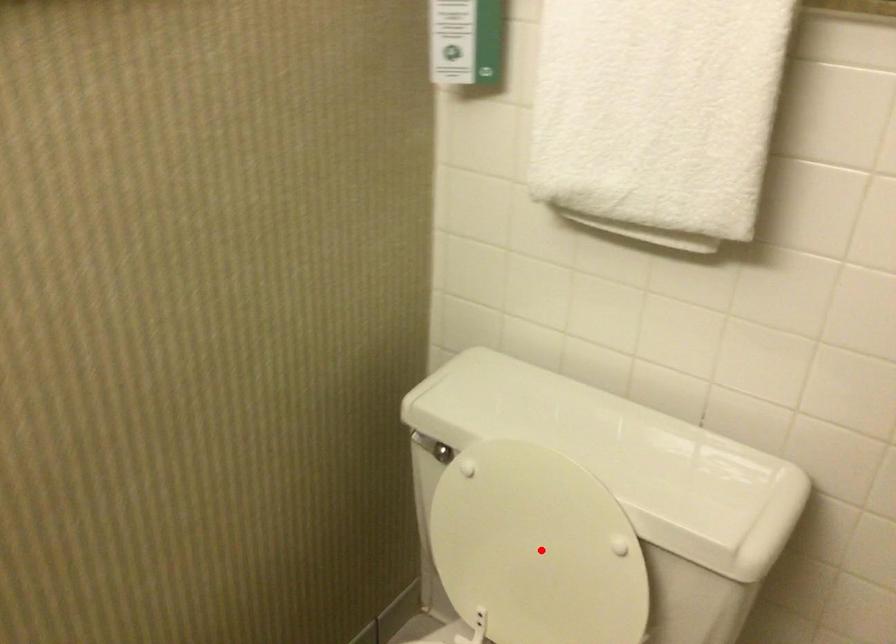
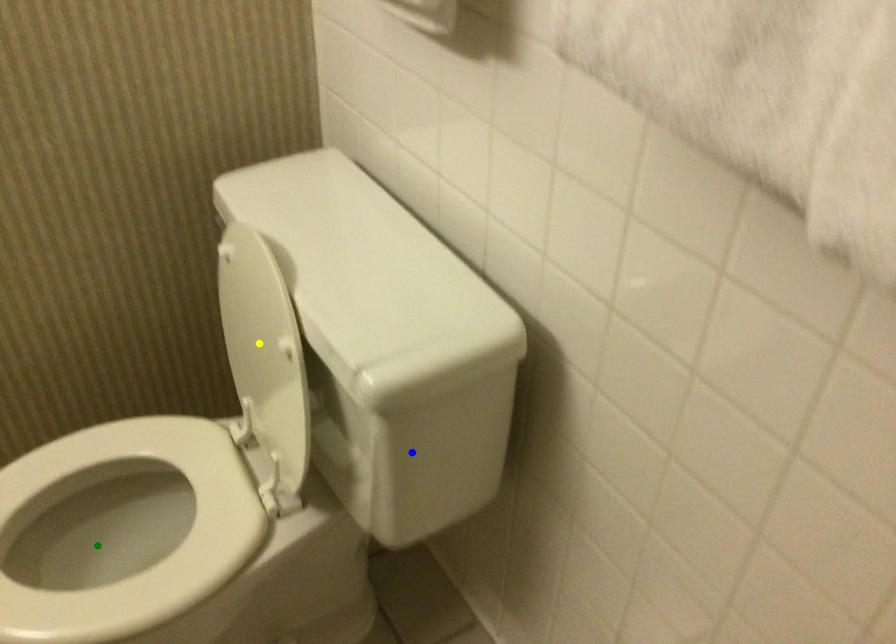
Question: I am providing you with two images of the same scene from different viewpoints. A red point is marked on the first image. You are given multiple points on the second image. Which mark in image 2 goes with the point in image 1?

Choices:
 (A) blue point
 (B) green point
 (C) yellow point

Answer: (C)